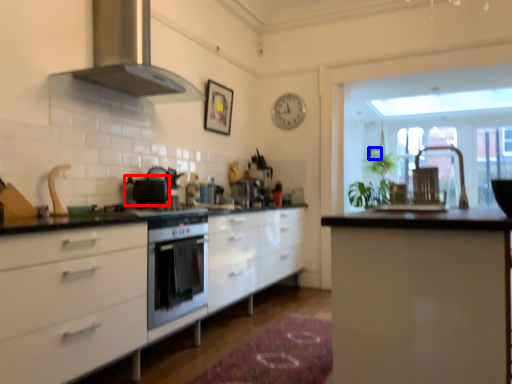
Question: Which object appears closest to the camera in this image, appliance (highlighted by a red box) or picture frame (highlighted by a blue box)?

Choices:
 (A) appliance
 (B) picture frame

Answer: (A)